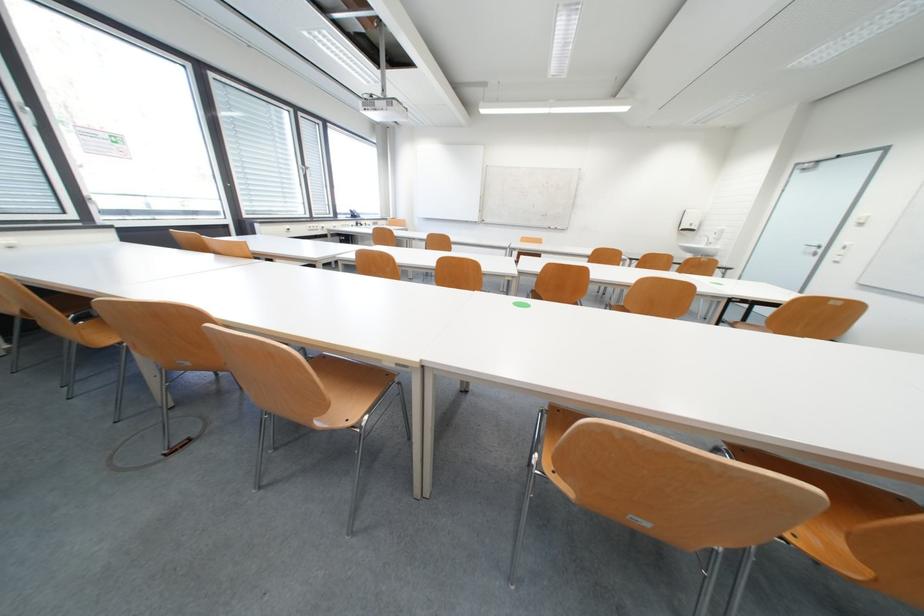
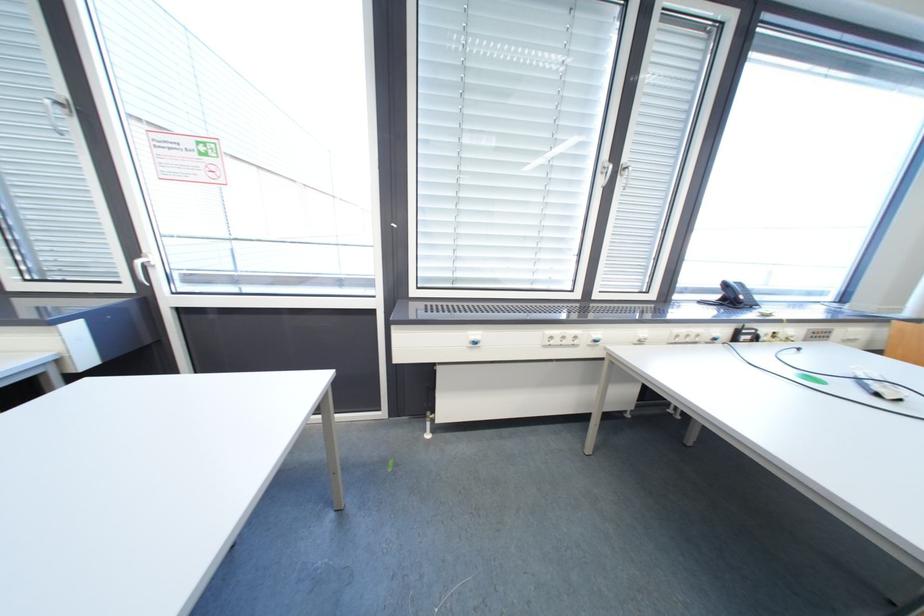
The point at (293, 227) is marked in the first image. Where is the corresponding point in the second image?

(480, 334)